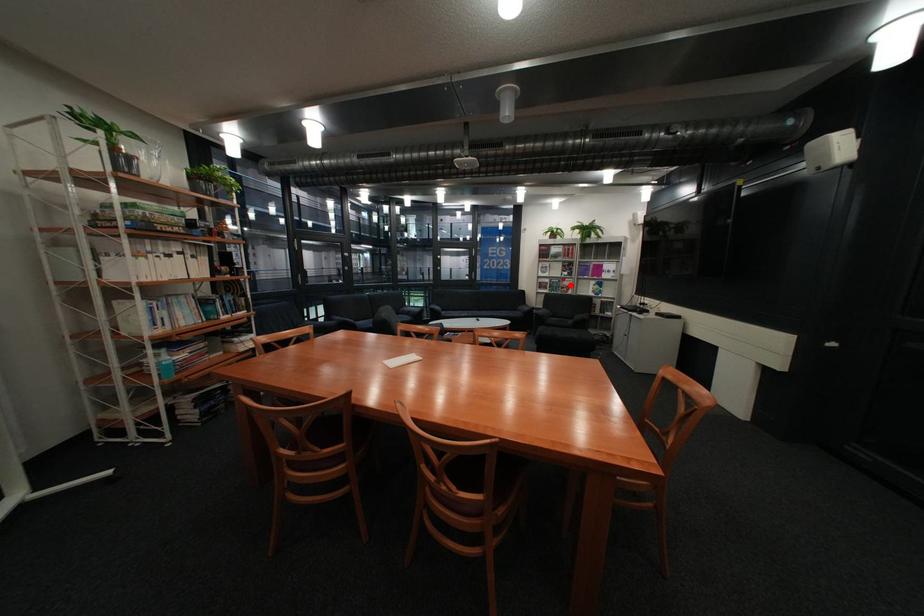
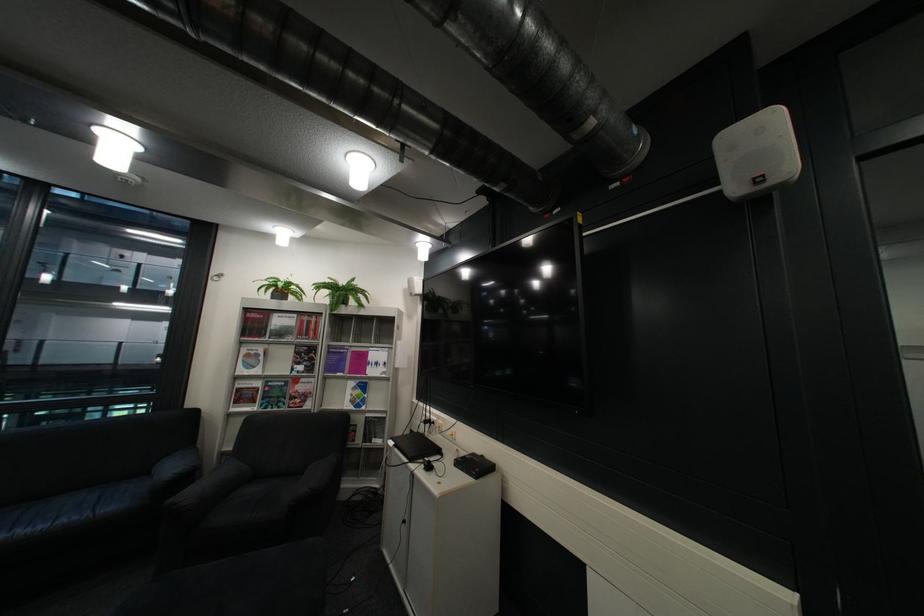
Find the pixel in the second image that matches the highlighted location in the first image.

(290, 394)